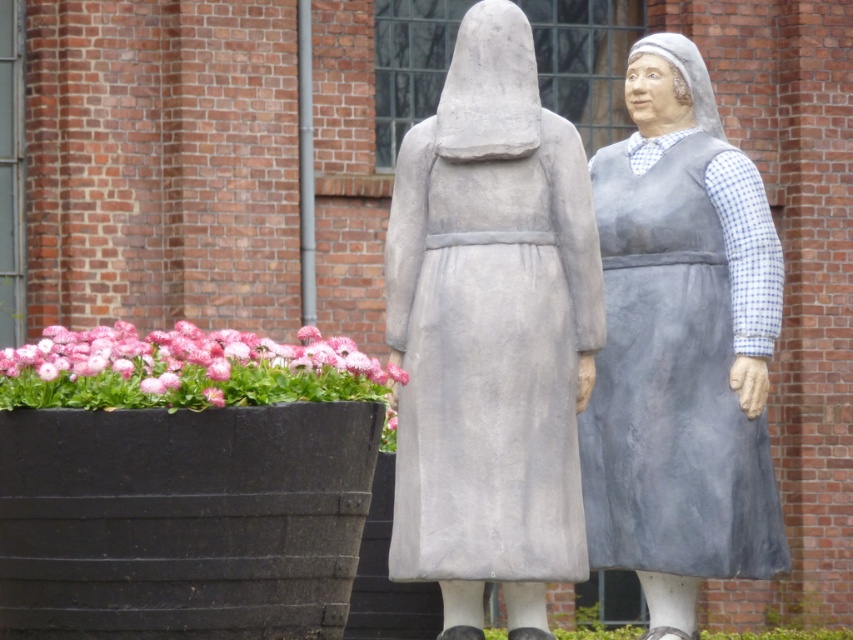
You are standing in front of two statues in a public square. You see the gray stone statue at center and the gray fabric dress at center. Which statue is positioned to the left of the other?

The gray stone statue at center is positioned to the left of the gray fabric dress at center.

You are an artist planning to create a miniature version of the scene. You need to know which object requires more material for its base. Based on the gray fabric dress at center and the pink fabric flowers at lower left, which one would need a larger base?

The pink fabric flowers at lower left would require a larger base because they occupy more space than the gray fabric dress at center.

You are an art student trying to sketch both the gray stone statue at center and the gray fabric dress at center for a project. Which object should you focus on first if you want to draw the larger one first?

The gray stone statue at center is larger in size than the gray fabric dress at center, so you should focus on drawing the gray stone statue at center first.